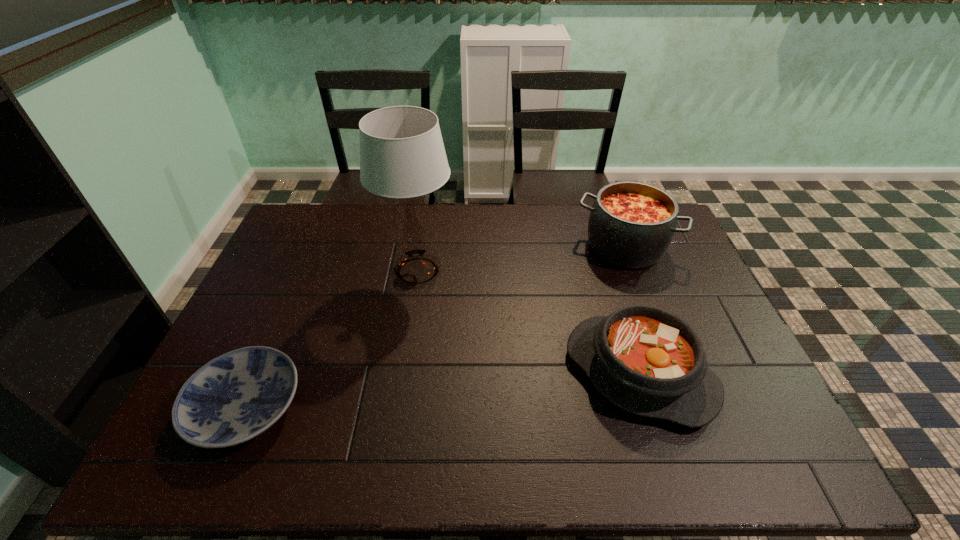
The height and width of the screenshot is (540, 960). In order to click on table lamp in this screenshot , I will do `click(402, 155)`.

Image resolution: width=960 pixels, height=540 pixels. I want to click on the second object from left to right, so click(x=402, y=155).

Find the location of a particular element. the third shortest object is located at coordinates (631, 224).

Find the location of `the farther casserole`. the farther casserole is located at coordinates (631, 224).

Identify the location of the shorter casserole. (645, 360).

Locate an element on the screen. This screenshot has height=540, width=960. the nearer casserole is located at coordinates (645, 360).

At what (x,y) coordinates should I click in order to perform the action: click on the leftmost object. Please return your answer as a coordinate pair (x, y). This screenshot has width=960, height=540. Looking at the image, I should click on (237, 396).

The width and height of the screenshot is (960, 540). What are the coordinates of `the shortest object` in the screenshot? It's located at (237, 396).

Find the location of a particular element. vacant space situated on the front-facing side of the tallest object is located at coordinates tap(544, 271).

Identify the location of free location located 0.400m on the left of the second tallest object. The width and height of the screenshot is (960, 540). (459, 247).